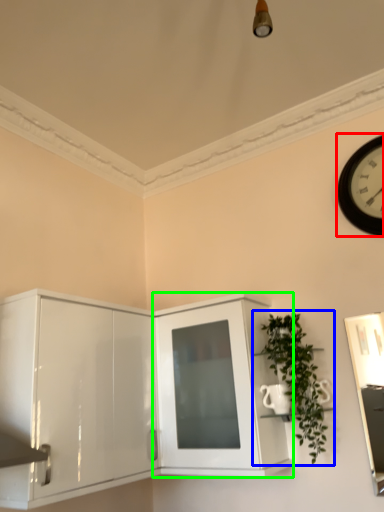
Question: Estimate the real-world distances between objects in this image. Which object is closer to wall clock (highlighted by a red box), houseplant (highlighted by a blue box) or cabinetry (highlighted by a green box)?

Choices:
 (A) houseplant
 (B) cabinetry

Answer: (A)